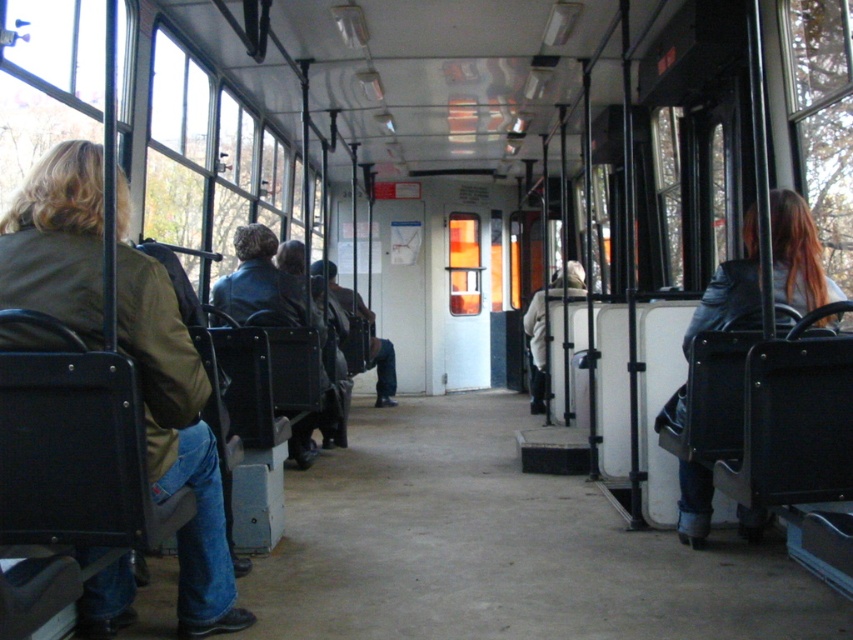
Question: Can you confirm if green matte jacket at left is wider than leather jacket at center?

Choices:
 (A) yes
 (B) no

Answer: (B)

Question: Which object is positioned closest to the green matte jacket at left?

Choices:
 (A) leather jacket at center
 (B) leather jacket at right
 (C) white fabric coat at center

Answer: (B)

Question: Which point is farther to the camera?

Choices:
 (A) leather jacket at center
 (B) white fabric coat at center
 (C) leather jacket at right
 (D) green matte jacket at left

Answer: (B)

Question: Can you confirm if leather jacket at right is bigger than white fabric coat at center?

Choices:
 (A) yes
 (B) no

Answer: (B)

Question: Is green matte jacket at left positioned at the back of leather jacket at center?

Choices:
 (A) yes
 (B) no

Answer: (B)

Question: Estimate the real-world distances between objects in this image. Which object is farther from the white fabric coat at center?

Choices:
 (A) leather jacket at right
 (B) green matte jacket at left
 (C) leather jacket at center

Answer: (B)